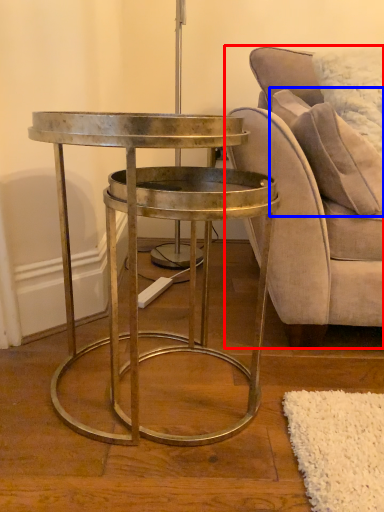
Question: Among these objects, which one is nearest to the camera, chair (highlighted by a red box) or pillow (highlighted by a blue box)?

Choices:
 (A) chair
 (B) pillow

Answer: (A)